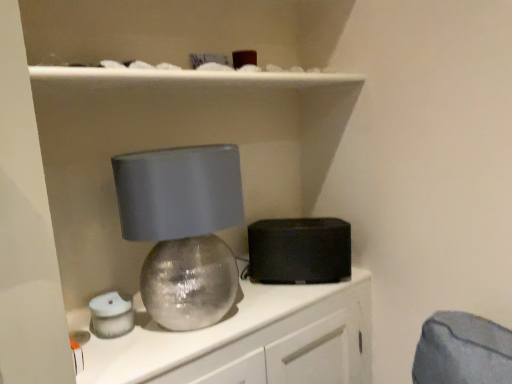
Question: Should I look upward or downward to see matte gray lampshade at center?

Choices:
 (A) down
 (B) up

Answer: (A)

Question: Considering the relative sizes of matte silver sphere at center and matte gray lampshade at center in the image provided, is matte silver sphere at center thinner than matte gray lampshade at center?

Choices:
 (A) yes
 (B) no

Answer: (B)

Question: Is matte silver sphere at center in front of matte gray lampshade at center?

Choices:
 (A) yes
 (B) no

Answer: (A)

Question: Could matte gray lampshade at center be considered to be inside matte silver sphere at center?

Choices:
 (A) no
 (B) yes

Answer: (A)

Question: Is matte silver sphere at center at the left side of matte gray lampshade at center?

Choices:
 (A) yes
 (B) no

Answer: (B)

Question: From the image's perspective, is matte silver sphere at center located beneath matte gray lampshade at center?

Choices:
 (A) no
 (B) yes

Answer: (B)

Question: Is matte silver sphere at center far away from matte gray lampshade at center?

Choices:
 (A) no
 (B) yes

Answer: (A)

Question: Is matte silver sphere at center positioned in front of black matte speaker at center?

Choices:
 (A) yes
 (B) no

Answer: (A)

Question: From a real-world perspective, is matte silver sphere at center over black matte speaker at center?

Choices:
 (A) yes
 (B) no

Answer: (B)

Question: Is matte silver sphere at center next to black matte speaker at center and touching it?

Choices:
 (A) yes
 (B) no

Answer: (B)

Question: Is matte silver sphere at center to the right of black matte speaker at center from the viewer's perspective?

Choices:
 (A) no
 (B) yes

Answer: (A)

Question: Is matte silver sphere at center not inside black matte speaker at center?

Choices:
 (A) no
 (B) yes

Answer: (B)

Question: From the image's perspective, is matte silver sphere at center over black matte speaker at center?

Choices:
 (A) yes
 (B) no

Answer: (B)

Question: Considering the relative positions of black matte speaker at center and matte silver sphere at center in the image provided, is black matte speaker at center in front of matte silver sphere at center?

Choices:
 (A) yes
 (B) no

Answer: (B)